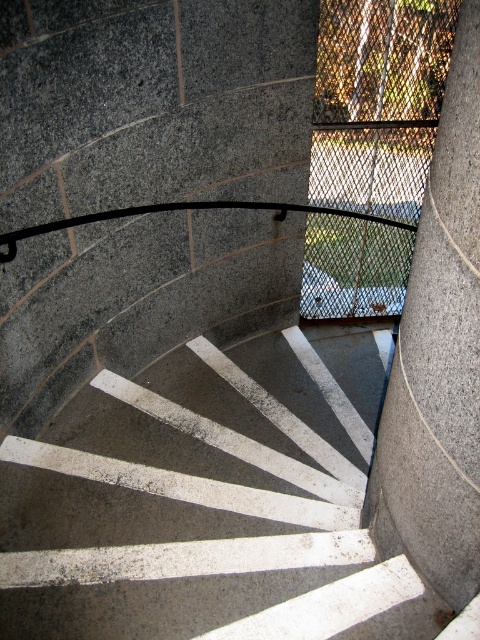
Which is behind, point (25, 461) or point (410, 365)?

Point (25, 461)

Does concrete stairs at center appear on the left side of gray granite pillar at center?

Correct, you'll find concrete stairs at center to the left of gray granite pillar at center.

The height and width of the screenshot is (640, 480). What do you see at coordinates (210, 502) in the screenshot?
I see `concrete stairs at center` at bounding box center [210, 502].

The image size is (480, 640). Identify the location of concrete stairs at center. (210, 502).